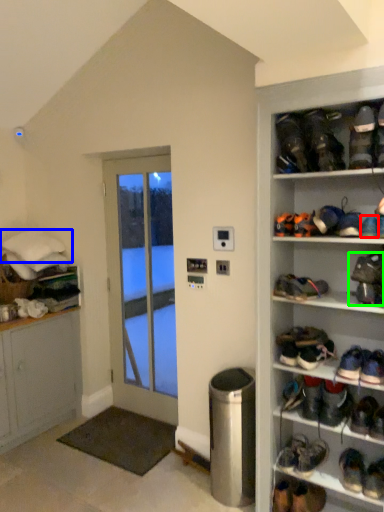
Question: Which object is positioned closest to footwear (highlighted by a red box)? Select from cushion (highlighted by a blue box) and footwear (highlighted by a green box).

Choices:
 (A) cushion
 (B) footwear

Answer: (B)